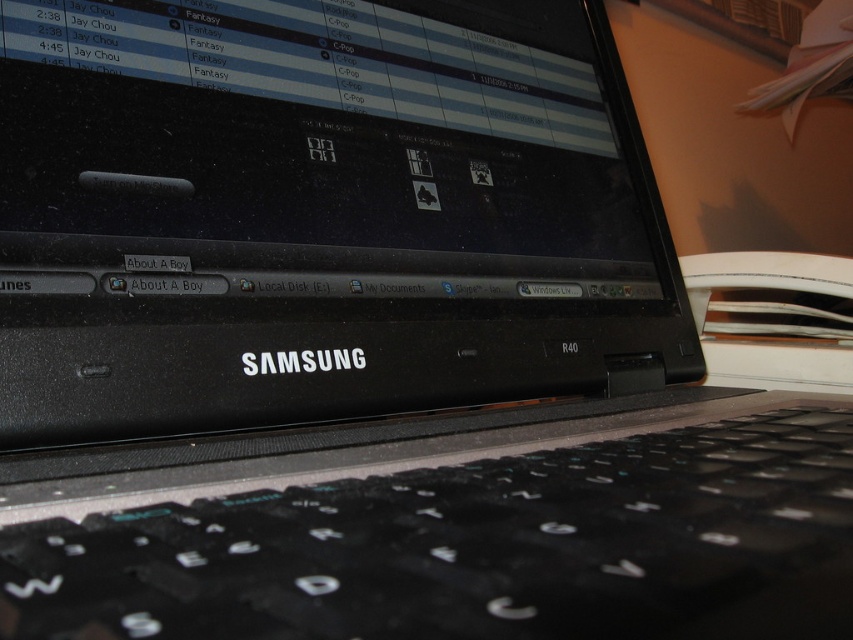
Question: Does black matte computer screen at center appear on the left side of black plastic keyboard at center?

Choices:
 (A) yes
 (B) no

Answer: (A)

Question: Can you confirm if black matte computer screen at center is bigger than black plastic keyboard at center?

Choices:
 (A) no
 (B) yes

Answer: (B)

Question: Which point is farther to the camera?

Choices:
 (A) (184, 172)
 (B) (511, 564)

Answer: (A)

Question: Among these objects, which one is farthest from the camera?

Choices:
 (A) black plastic keyboard at center
 (B) black matte computer screen at center

Answer: (B)

Question: Does black matte computer screen at center have a greater width compared to black plastic keyboard at center?

Choices:
 (A) no
 (B) yes

Answer: (B)